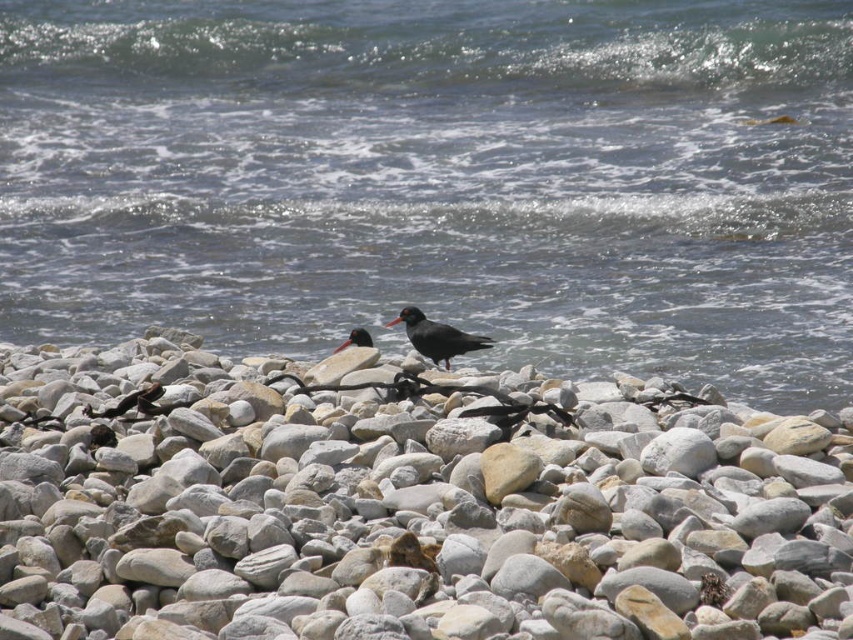
The width and height of the screenshot is (853, 640). I want to click on clear water at center, so click(439, 179).

The height and width of the screenshot is (640, 853). What are the coordinates of `clear water at center` in the screenshot? It's located at (439, 179).

Is point (465, 312) less distant than point (155, 388)?

No, (465, 312) is behind (155, 388).

Does clear water at center lie in front of black matte bird at lower left?

No, it is not.

Is point (4, 337) behind point (112, 412)?

Yes.

Where is `clear water at center`? clear water at center is located at coordinates (439, 179).

Between clear water at center and black matte bird at center, which one is positioned higher?

clear water at center is above.

The width and height of the screenshot is (853, 640). Describe the element at coordinates (439, 179) in the screenshot. I see `clear water at center` at that location.

Which is in front, point (669, 264) or point (430, 330)?

Point (430, 330) is more forward.

This screenshot has width=853, height=640. In order to click on clear water at center in this screenshot , I will do `click(439, 179)`.